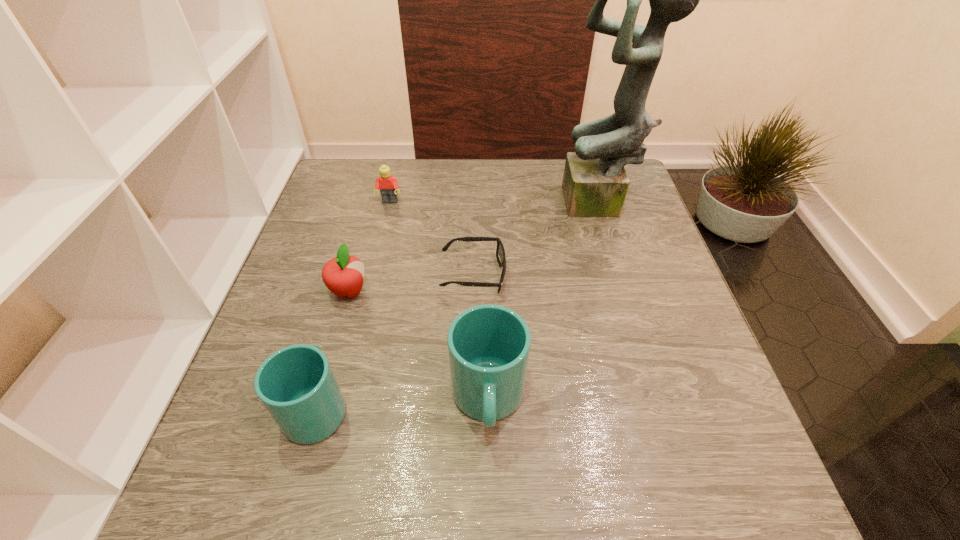
This screenshot has width=960, height=540. Find the location of `the shorter cup`. the shorter cup is located at coordinates (296, 384).

Find the location of a particular element. The image size is (960, 540). the fourth shortest object is located at coordinates (296, 384).

The width and height of the screenshot is (960, 540). I want to click on the right cup, so pos(488,345).

The width and height of the screenshot is (960, 540). I want to click on the second tallest object, so click(488, 345).

At what (x,y) coordinates should I click in order to perform the action: click on Lego. Please return your answer as a coordinate pair (x, y). Looking at the image, I should click on (388, 185).

At what (x,y) coordinates should I click in order to perform the action: click on sculpture. Please return your answer as a coordinate pair (x, y). The image size is (960, 540). Looking at the image, I should click on (595, 183).

Where is `the rightmost object`? Image resolution: width=960 pixels, height=540 pixels. the rightmost object is located at coordinates (595, 183).

At what (x,y) coordinates should I click in order to perform the action: click on apple. Please return your answer as a coordinate pair (x, y). This screenshot has width=960, height=540. Looking at the image, I should click on (343, 275).

Where is `sunglasses`? sunglasses is located at coordinates (500, 252).

Locate an element on the screen. This screenshot has width=960, height=540. vacant space located 0.290m on the handle side of the left cup is located at coordinates (356, 266).